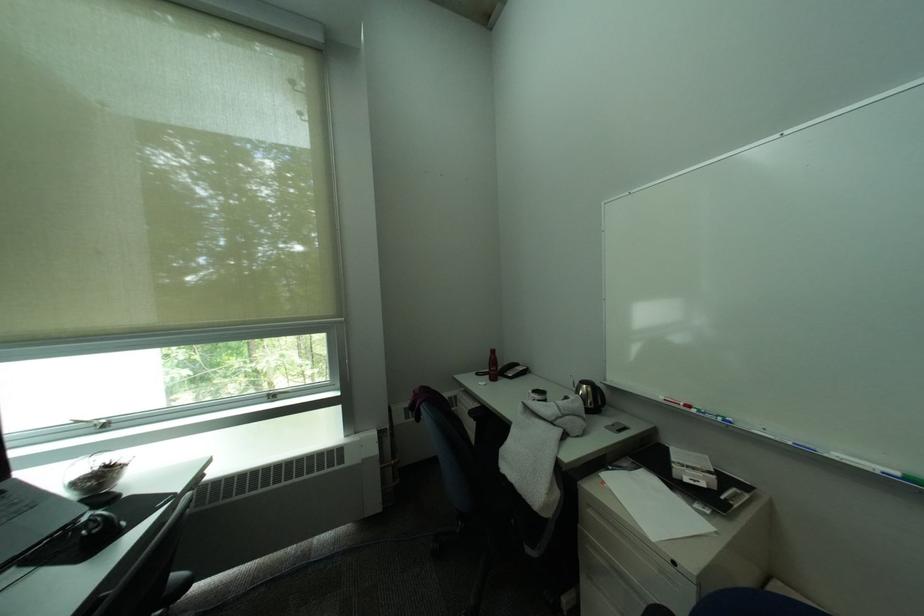
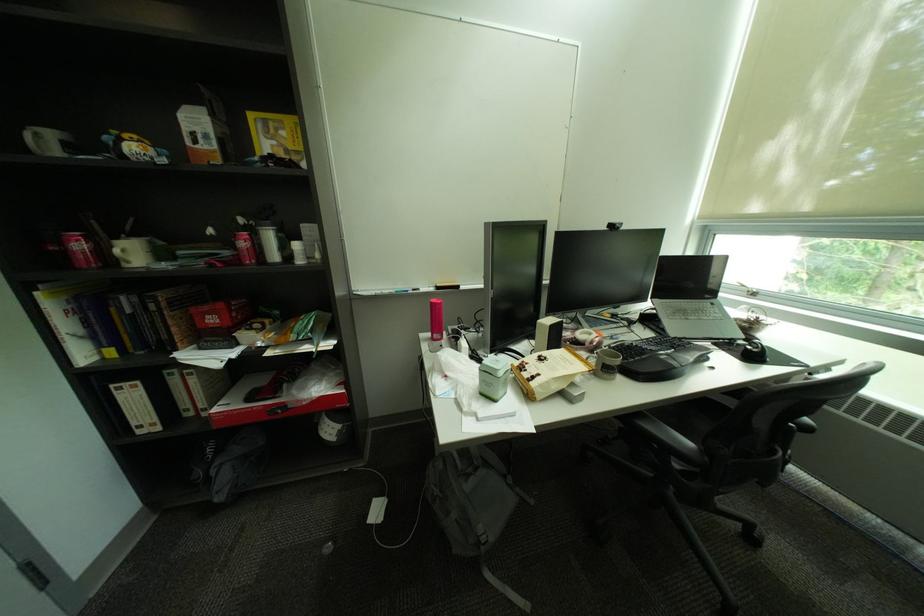
In the second image, find the point that corresponds to (106,532) in the first image.

(766, 352)